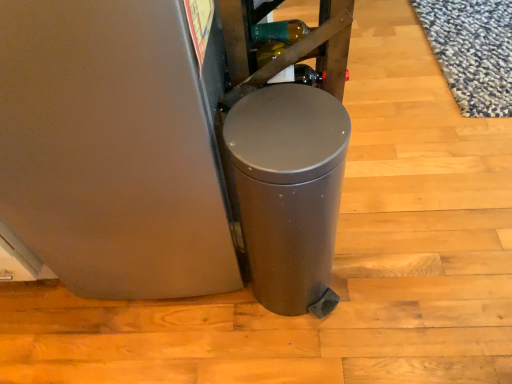
Question: Visually, is satin metallic trash can at center positioned to the left or to the right of metallic brown shelf at upper center?

Choices:
 (A) right
 (B) left

Answer: (A)

Question: In terms of size, does satin metallic trash can at center appear bigger or smaller than metallic brown shelf at upper center?

Choices:
 (A) small
 (B) big

Answer: (B)

Question: Considering the positions of point (234, 104) and point (224, 97), is point (234, 104) closer or farther from the camera than point (224, 97)?

Choices:
 (A) farther
 (B) closer

Answer: (B)

Question: Which is correct: metallic brown shelf at upper center is inside satin metallic trash can at center, or outside of it?

Choices:
 (A) outside
 (B) inside

Answer: (A)

Question: In terms of size, does metallic brown shelf at upper center appear bigger or smaller than satin metallic trash can at center?

Choices:
 (A) big
 (B) small

Answer: (B)

Question: From the image's perspective, is metallic brown shelf at upper center positioned above or below satin metallic trash can at center?

Choices:
 (A) above
 (B) below

Answer: (A)

Question: Does point (312, 46) appear closer or farther from the camera than point (270, 195)?

Choices:
 (A) farther
 (B) closer

Answer: (A)